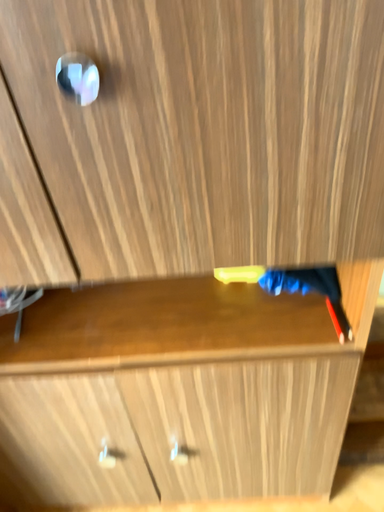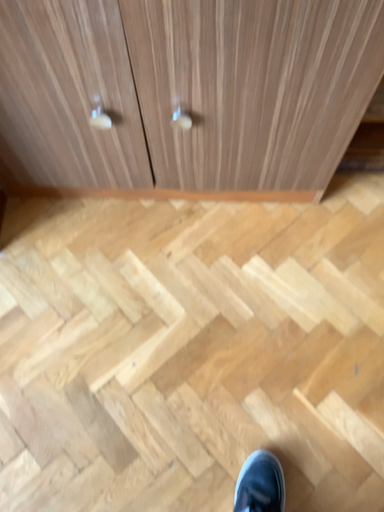
Question: Which way did the camera rotate in the video?

Choices:
 (A) rotated downward
 (B) rotated upward

Answer: (A)